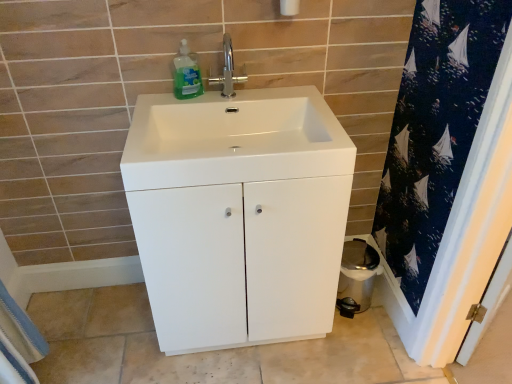
Question: Considering the positions of point (221, 77) and point (271, 150), is point (221, 77) closer or farther from the camera than point (271, 150)?

Choices:
 (A) farther
 (B) closer

Answer: (A)

Question: From their relative heights in the image, would you say polished chrome faucet at center is taller or shorter than white glossy sink at center?

Choices:
 (A) short
 (B) tall

Answer: (B)

Question: Estimate the real-world distances between objects in this image. Which object is farther from the white glossy cabinet at center?

Choices:
 (A) white cotton bath towel at lower left
 (B) white glossy sink at center
 (C) green translucent liquid at upper center
 (D) white glossy toilet bowl at lower right
 (E) polished chrome faucet at center

Answer: (A)

Question: Which object is the closest to the polished chrome faucet at center?

Choices:
 (A) white glossy cabinet at center
 (B) green translucent liquid at upper center
 (C) white cotton bath towel at lower left
 (D) white glossy sink at center
 (E) white glossy toilet bowl at lower right

Answer: (B)